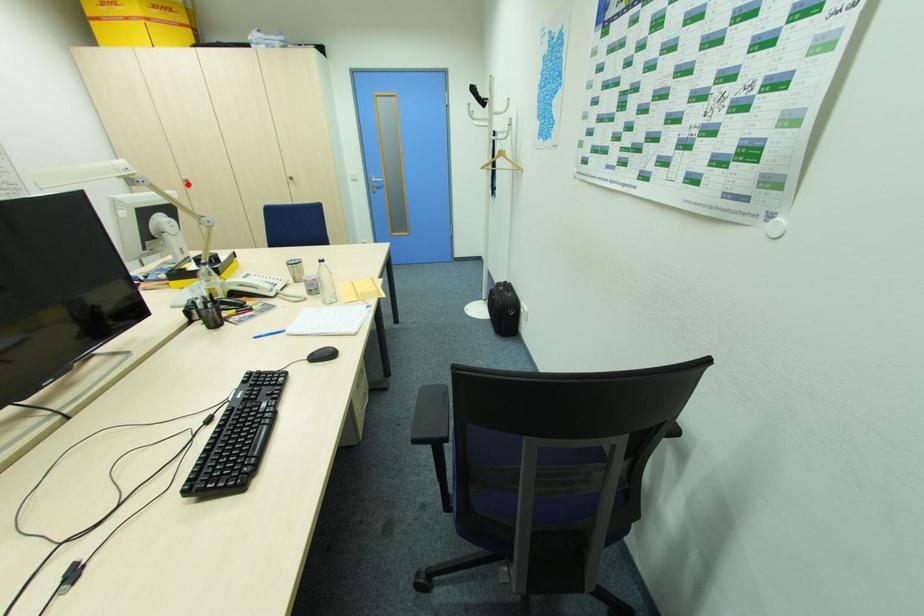
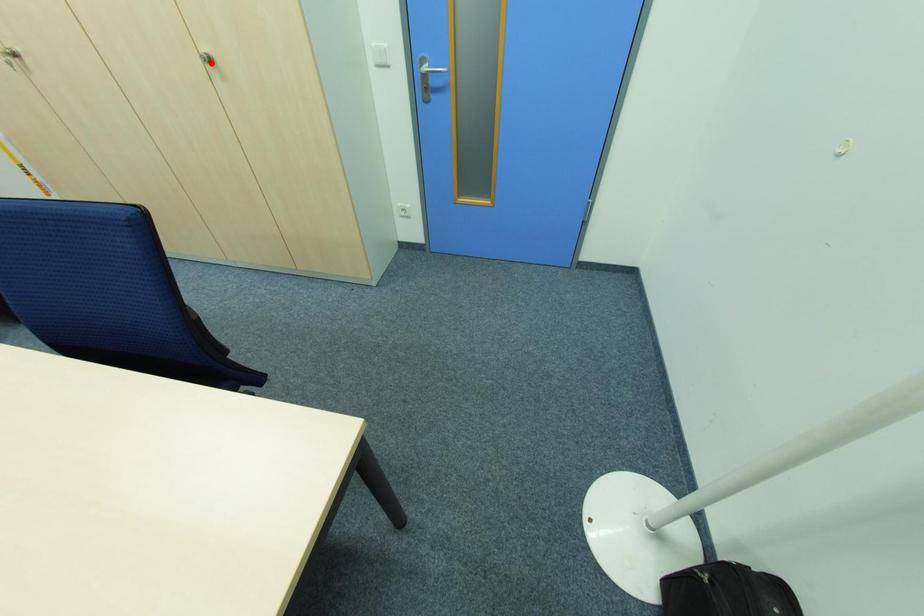
I am providing you with two images of the same scene from different viewpoints. A red point is marked on the first image and another point is marked on the second image. Do the highlighted points in image1 and image2 indicate the same real-world spot?

No